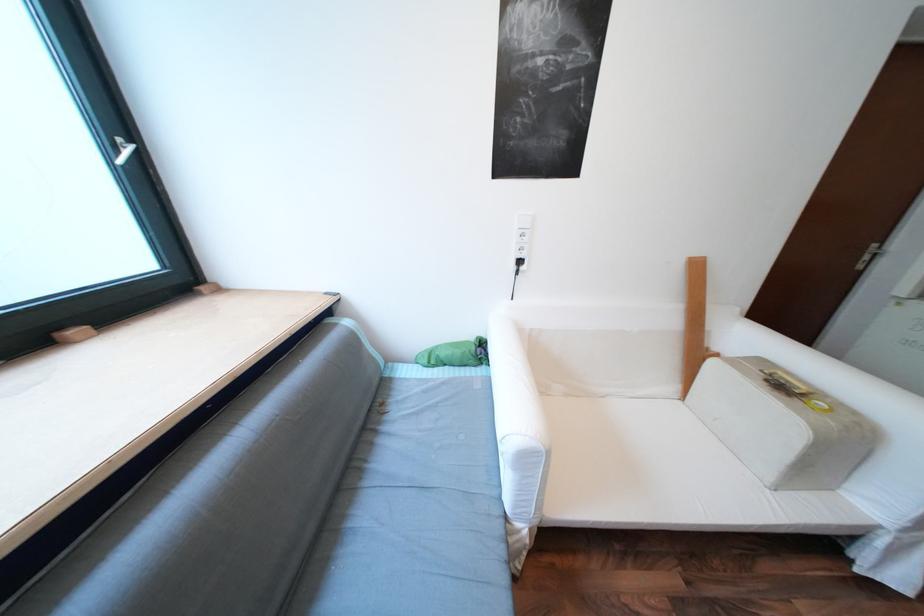
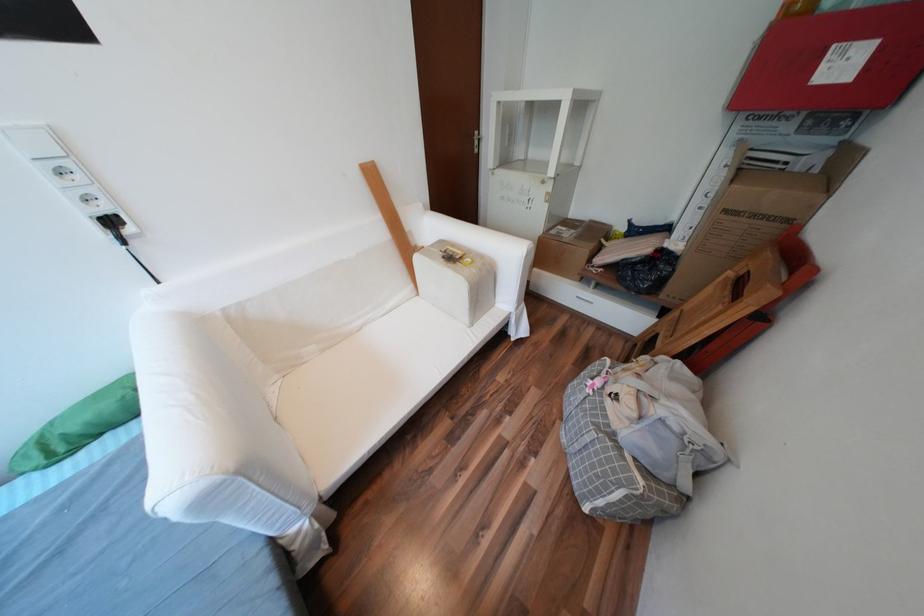
Find the pixel in the second image that matches (x=531, y=268) in the first image.

(138, 231)